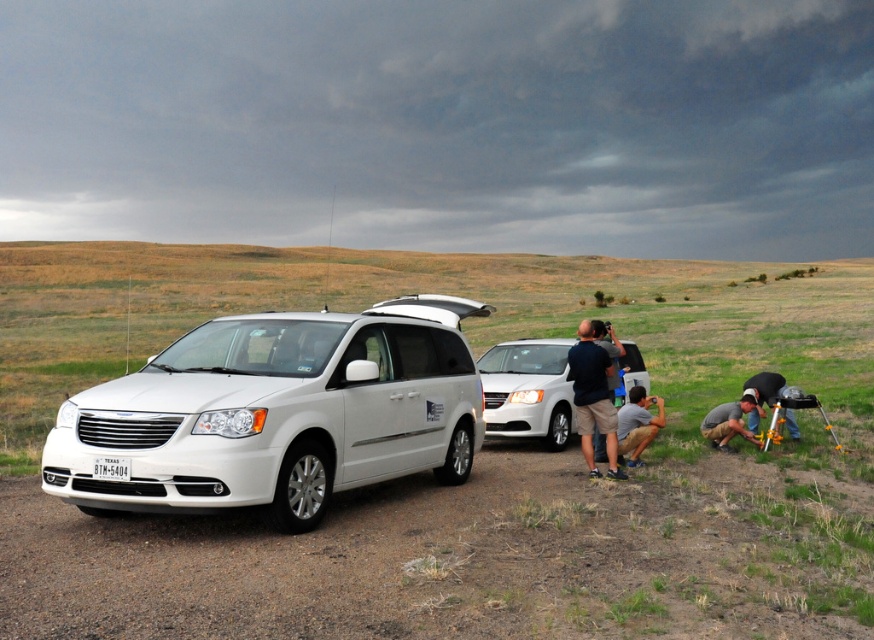
Who is taller, white matte van at center or matte black camera at center?

Standing taller between the two is matte black camera at center.

Who is more distant from viewer, [553,339] or [577,342]?

Point [553,339]

The width and height of the screenshot is (874, 640). Find the location of `white matte van at center`. white matte van at center is located at coordinates (529, 390).

Is dirt track at lower left wider than green grass at lower right?

No.

Is point (483, 627) less distant than point (489, 340)?

Yes, it is.

What do you see at coordinates (477, 554) in the screenshot?
I see `dirt track at lower left` at bounding box center [477, 554].

I want to click on dirt track at lower left, so 477,554.

Can you confirm if dirt track at lower left is smaller than metallic silver tripod at lower right?

No.

The width and height of the screenshot is (874, 640). What do you see at coordinates (477, 554) in the screenshot?
I see `dirt track at lower left` at bounding box center [477, 554].

Between point (677, 467) and point (761, 372), which one is positioned in front?

Point (677, 467)

At what (x,y) coordinates should I click in order to perform the action: click on dirt track at lower left. Please return your answer as a coordinate pair (x, y). Image resolution: width=874 pixels, height=640 pixels. Looking at the image, I should click on (477, 554).